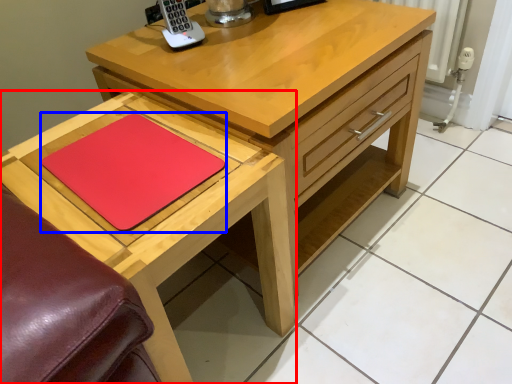
Question: Which point is further to the camera, table (highlighted by a red box) or pad (highlighted by a blue box)?

Choices:
 (A) table
 (B) pad

Answer: (B)